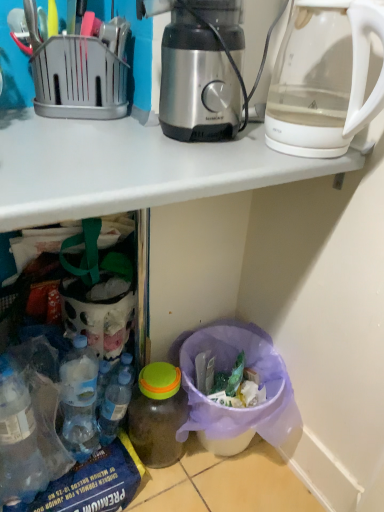
The width and height of the screenshot is (384, 512). I want to click on vacant region to the left of stainless steel coffee maker at center, so 92,135.